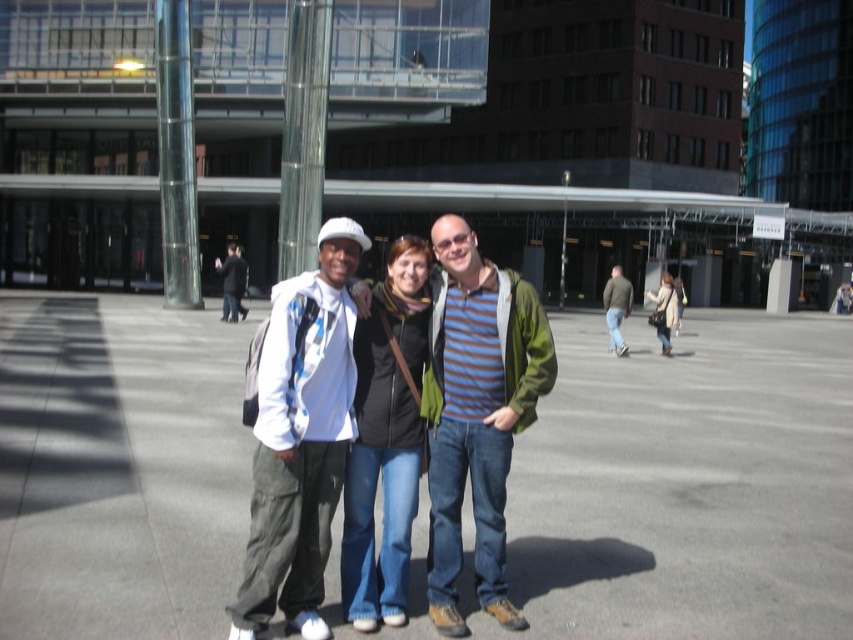
From the picture: Between black leather jacket at center and white cotton hoodie at center, which one has more height?

white cotton hoodie at center is taller.

Between point (368, 608) and point (234, 273), which one is positioned in front?

Point (368, 608) is in front.

Does point (372, 624) lie behind point (225, 278)?

No.

This screenshot has height=640, width=853. What are the coordinates of `black leather jacket at center` in the screenshot? It's located at (386, 435).

Which is behind, point (229, 272) or point (657, 317)?

The point (229, 272) is behind.

Is white cotton hoodie at center shorter than light brown leather jacket at center?

In fact, white cotton hoodie at center may be taller than light brown leather jacket at center.

Does point (235, 257) come in front of point (656, 292)?

Yes, it is in front of point (656, 292).

This screenshot has width=853, height=640. Find the location of `white cotton hoodie at center`. white cotton hoodie at center is located at coordinates (231, 282).

Is matte white jacket at center taller than white matte jacket at left?

No.

Between matte white jacket at center and white matte jacket at left, which one has more height?

white matte jacket at left is taller.

Does point (264, 593) come farther from viewer compared to point (329, 220)?

No, it is not.

Identify the location of matte white jacket at center. (302, 433).